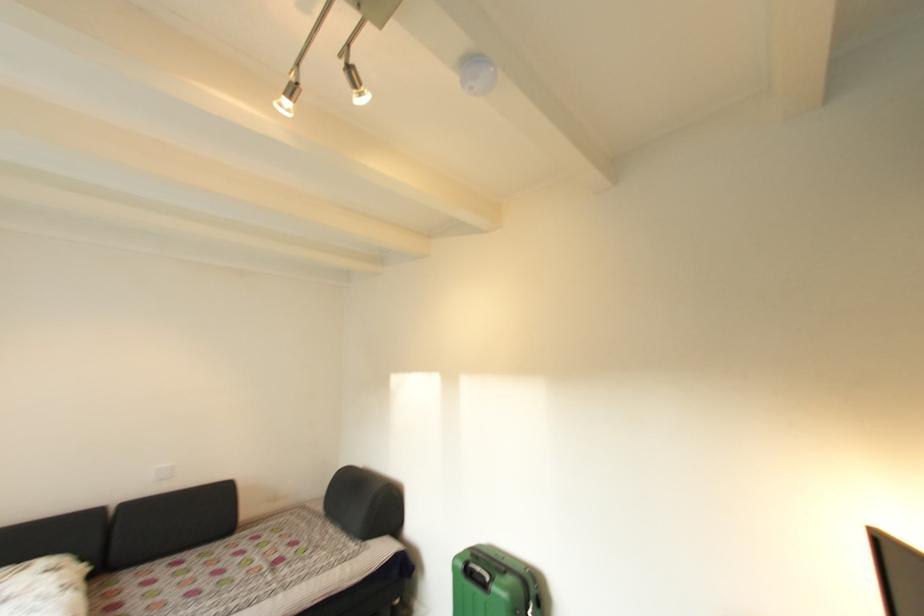
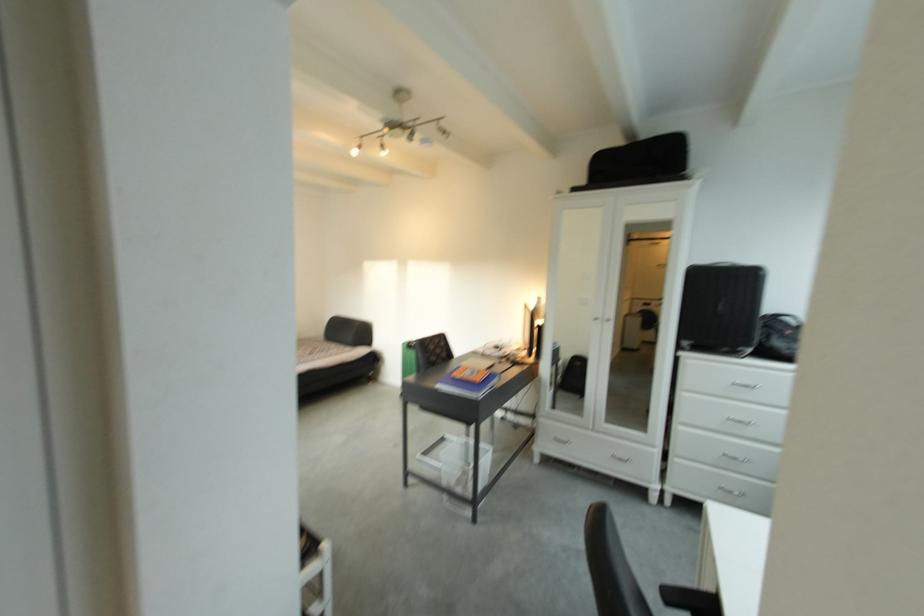
Question: In a continuous first-person perspective shot, in which direction is the camera moving?

Choices:
 (A) Left
 (B) Right
 (C) Forward
 (D) Backward

Answer: (D)